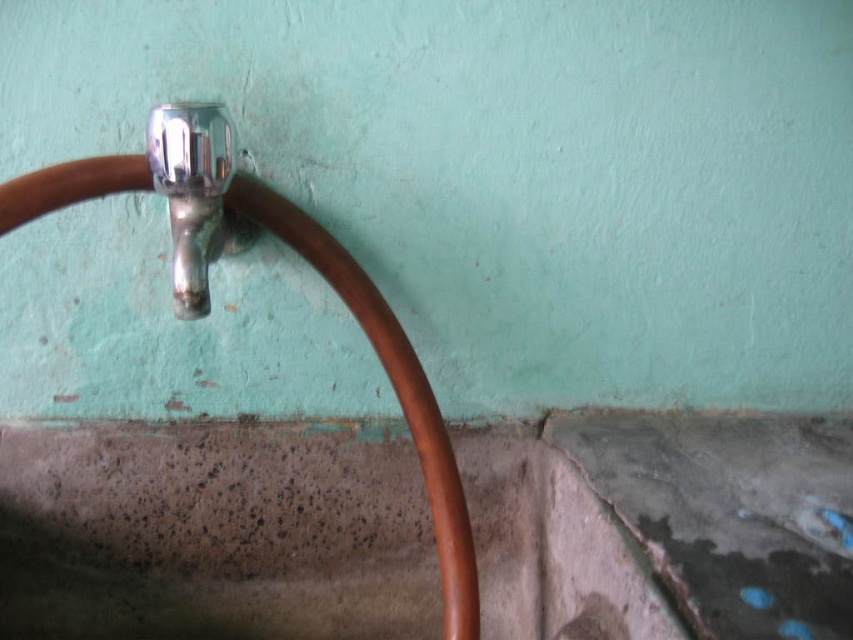
Describe the element at coordinates (392, 385) in the screenshot. I see `shiny copper hose at upper left` at that location.

Measure the distance between shiny copper hose at upper left and camera.

A distance of 25.28 inches exists between shiny copper hose at upper left and camera.

At what (x,y) coordinates should I click in order to perform the action: click on shiny copper hose at upper left. Please return your answer as a coordinate pair (x, y). Image resolution: width=853 pixels, height=640 pixels. Looking at the image, I should click on (392, 385).